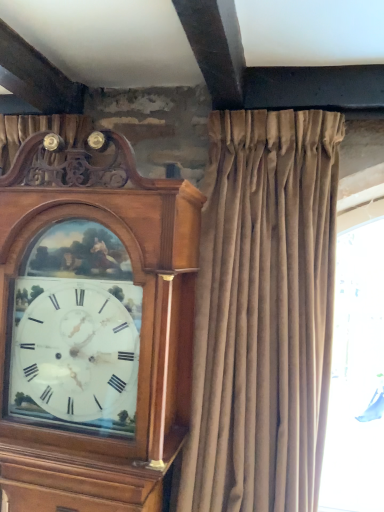
Question: Does velvet beige curtain at center come behind wooden grandfather clock at left?

Choices:
 (A) no
 (B) yes

Answer: (A)

Question: Does velvet beige curtain at center have a larger size compared to wooden grandfather clock at left?

Choices:
 (A) no
 (B) yes

Answer: (B)

Question: Is velvet beige curtain at center facing away from wooden grandfather clock at left?

Choices:
 (A) no
 (B) yes

Answer: (A)

Question: Does velvet beige curtain at center have a lesser width compared to wooden grandfather clock at left?

Choices:
 (A) yes
 (B) no

Answer: (B)

Question: Can wooden grandfather clock at left be found inside velvet beige curtain at center?

Choices:
 (A) yes
 (B) no

Answer: (B)

Question: Is velvet beige curtain at center at the right side of wooden grandfather clock at left?

Choices:
 (A) no
 (B) yes

Answer: (B)

Question: From the image's perspective, would you say wooden grandfather clock at left is positioned over velvet beige curtain at center?

Choices:
 (A) yes
 (B) no

Answer: (B)

Question: From a real-world perspective, is wooden grandfather clock at left located beneath velvet beige curtain at center?

Choices:
 (A) yes
 (B) no

Answer: (A)

Question: Is velvet beige curtain at center located within wooden grandfather clock at left?

Choices:
 (A) no
 (B) yes

Answer: (A)

Question: Does wooden grandfather clock at left come behind velvet beige curtain at center?

Choices:
 (A) yes
 (B) no

Answer: (A)

Question: Is velvet beige curtain at center at the back of wooden grandfather clock at left?

Choices:
 (A) yes
 (B) no

Answer: (B)

Question: From the image's perspective, does wooden grandfather clock at left appear lower than velvet beige curtain at center?

Choices:
 (A) yes
 (B) no

Answer: (A)

Question: Considering the positions of wooden grandfather clock at left and velvet beige curtain at center in the image, is wooden grandfather clock at left wider or thinner than velvet beige curtain at center?

Choices:
 (A) thin
 (B) wide

Answer: (A)